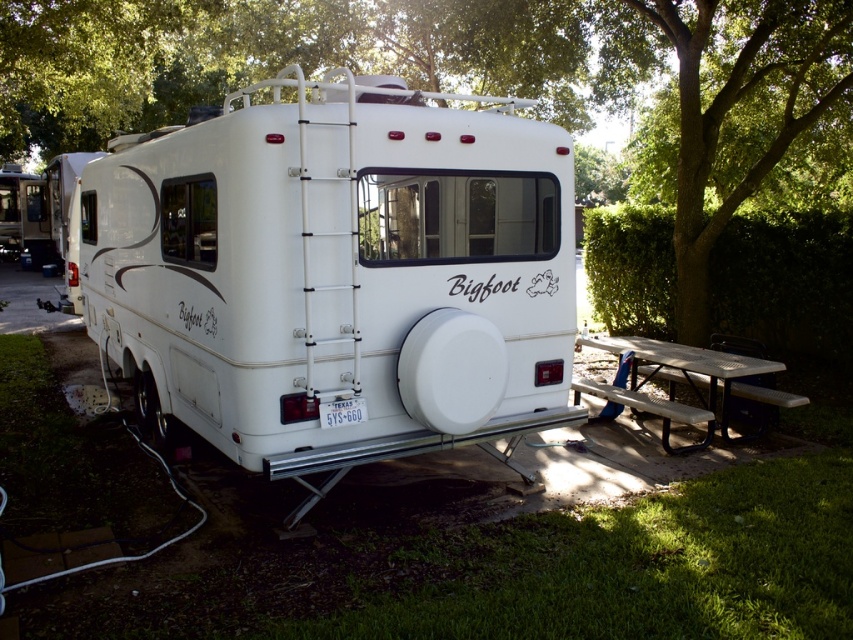
Between white matte recreational vehicle at center and green leafy tree at upper right, which one has less height?

green leafy tree at upper right is shorter.

Is point (265, 340) farther from camera compared to point (705, 124)?

No, it is not.

At what (x,y) coordinates should I click in order to perform the action: click on white matte recreational vehicle at center. Please return your answer as a coordinate pair (x, y). Image resolution: width=853 pixels, height=640 pixels. Looking at the image, I should click on click(335, 275).

Does green leafy tree at upper center have a greater height compared to white plastic picnic table at lower right?

Indeed, green leafy tree at upper center has a greater height compared to white plastic picnic table at lower right.

Is green leafy tree at upper center shorter than white plastic picnic table at lower right?

Incorrect, green leafy tree at upper center's height does not fall short of white plastic picnic table at lower right's.

Between point (265, 17) and point (749, 374), which one is positioned in front?

Point (749, 374) is in front.

The height and width of the screenshot is (640, 853). In order to click on green leafy tree at upper center in this screenshot , I will do `click(469, 77)`.

Between white matte recreational vehicle at center and white plastic picnic table at lower right, which one appears on the right side from the viewer's perspective?

white plastic picnic table at lower right

This screenshot has width=853, height=640. Identify the location of white matte recreational vehicle at center. (335, 275).

I want to click on white matte recreational vehicle at center, so click(x=335, y=275).